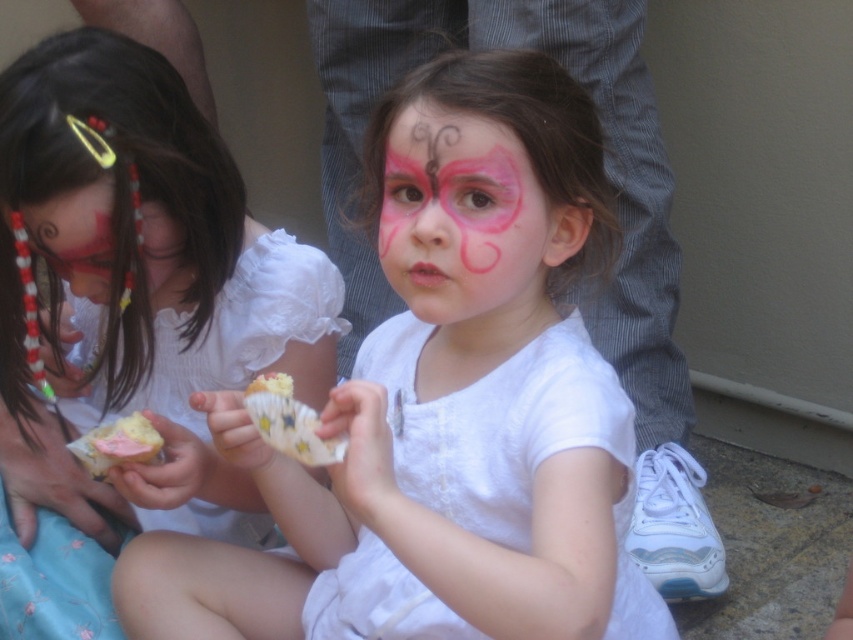
Does point (117, 211) come in front of point (628, 474)?

No, (117, 211) is further to viewer.

Describe the element at coordinates (129, 317) in the screenshot. This screenshot has width=853, height=640. I see `matte white dress at center` at that location.

You are a GUI agent. You are given a task and a screenshot of the screen. Output one action in this format:
    pyautogui.click(x=<x>, y=<y>)
    Task: Click on the matte white dress at center
    
    Given the screenshot: What is the action you would take?
    pyautogui.click(x=129, y=317)

Does point (540, 269) come farther from viewer compared to point (283, 387)?

Yes, point (540, 269) is farther from viewer.

Can you confirm if white matte shirt at center is wider than pink paper cupcake at center?

Indeed, white matte shirt at center has a greater width compared to pink paper cupcake at center.

Describe the element at coordinates (444, 406) in the screenshot. The image size is (853, 640). I see `white matte shirt at center` at that location.

In order to click on white matte shirt at center in this screenshot , I will do `click(444, 406)`.

Is the position of white cotton dress at center less distant than that of matte black face paint at left?

No, it is behind matte black face paint at left.

Which is behind, point (190, 316) or point (79, 200)?

The point (190, 316) is behind.

This screenshot has height=640, width=853. I want to click on white cotton dress at center, so click(242, 324).